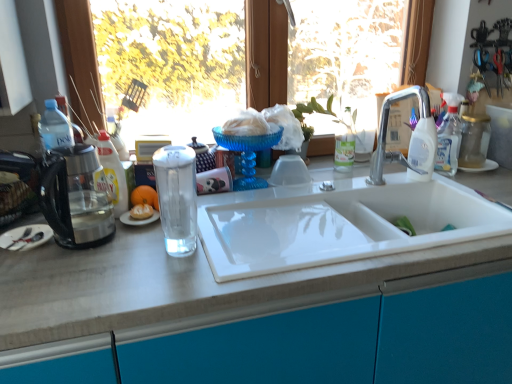
The height and width of the screenshot is (384, 512). In order to click on free location to the right of translucent glass kettle at left in this screenshot , I will do `click(143, 249)`.